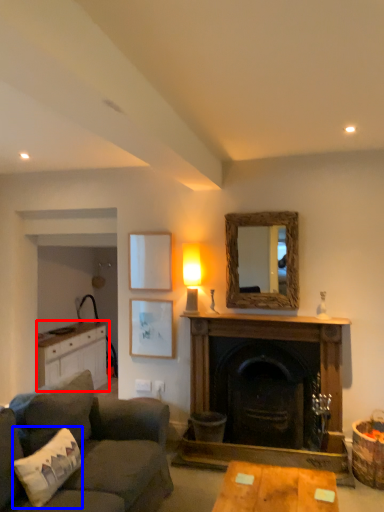
Question: Which object appears closest to the camera in this image, cabinetry (highlighted by a red box) or pillow (highlighted by a blue box)?

Choices:
 (A) cabinetry
 (B) pillow

Answer: (B)